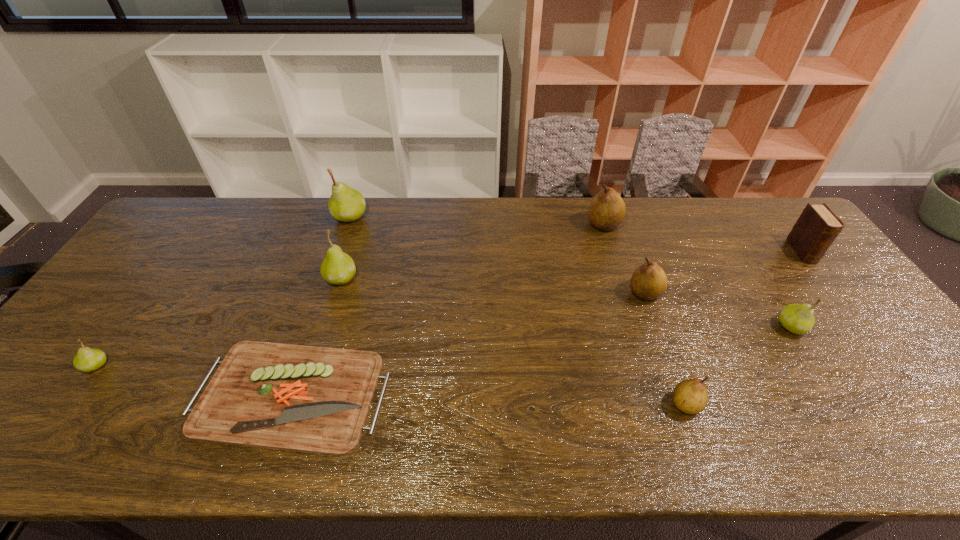
This screenshot has height=540, width=960. In order to click on the leftmost green pear in this screenshot , I will do `click(87, 359)`.

Find the location of a particular element. Image resolution: width=960 pixels, height=540 pixels. the smallest brown pear is located at coordinates [x=690, y=396].

Identify the location of the nearest pear. The width and height of the screenshot is (960, 540). (690, 396).

You are a GUI agent. You are given a task and a screenshot of the screen. Output one action in this format:
    pyautogui.click(x=<x>, y=<y>)
    Task: Click on the chopping board
    The width and height of the screenshot is (960, 540).
    Given the screenshot: What is the action you would take?
    pyautogui.click(x=308, y=399)

Where is `blank area located 0.300m on the left of the biggest green pear`? This screenshot has width=960, height=540. blank area located 0.300m on the left of the biggest green pear is located at coordinates (246, 217).

Identify the location of free location located on the right of the farthest brown pear. The image size is (960, 540). (699, 225).

Where is `vacant area situated 0.330m on the back of the third smallest green pear`? This screenshot has height=540, width=960. vacant area situated 0.330m on the back of the third smallest green pear is located at coordinates (365, 203).

I want to click on vacant space situated 0.210m on the spine side of the third farthest object, so click(x=853, y=318).

Identify the location of vacant space located on the right of the second nearest brown pear. This screenshot has height=540, width=960. (763, 293).

Find the location of `vacant space located 0.250m on the back of the second smallest green pear`. vacant space located 0.250m on the back of the second smallest green pear is located at coordinates (745, 254).